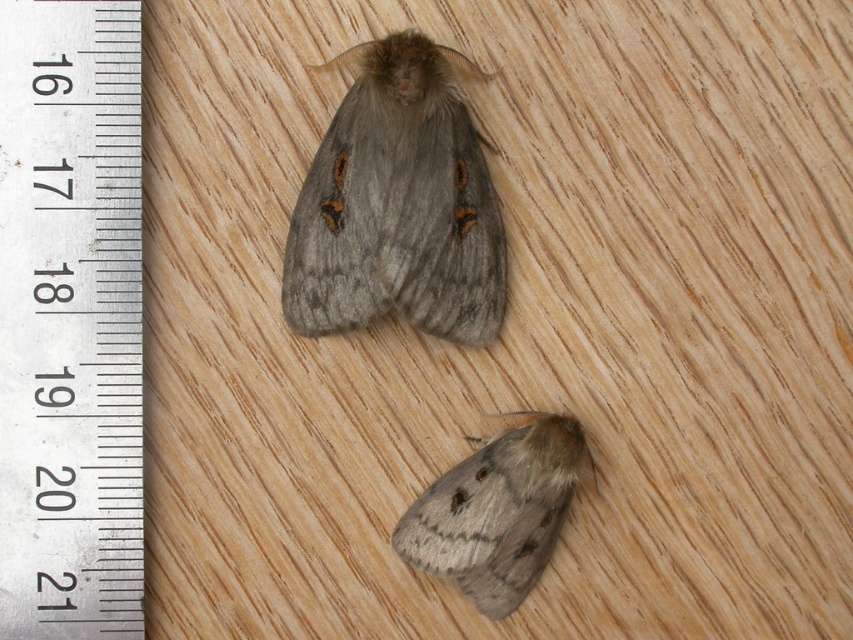
Question: Which of the following is the closest to the observer?

Choices:
 (A) fuzzy gray moth at lower center
 (B) fuzzy gray moth at upper center
 (C) metallic silver ruler at upper left

Answer: (C)

Question: Which object appears closest to the camera in this image?

Choices:
 (A) metallic silver ruler at upper left
 (B) fuzzy gray moth at upper center

Answer: (A)

Question: Does fuzzy gray moth at upper center have a greater width compared to fuzzy gray moth at lower center?

Choices:
 (A) no
 (B) yes

Answer: (B)

Question: Can you confirm if fuzzy gray moth at upper center is positioned below fuzzy gray moth at lower center?

Choices:
 (A) yes
 (B) no

Answer: (B)

Question: Which object appears closest to the camera in this image?

Choices:
 (A) metallic silver ruler at upper left
 (B) fuzzy gray moth at upper center

Answer: (A)

Question: Is metallic silver ruler at upper left closer to the viewer compared to fuzzy gray moth at lower center?

Choices:
 (A) yes
 (B) no

Answer: (A)